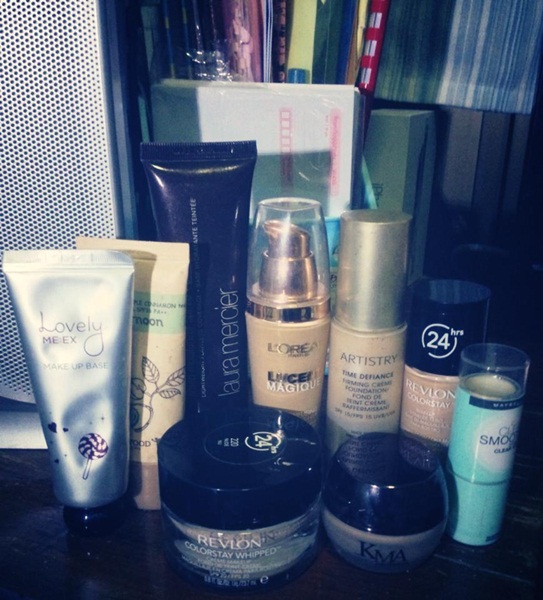
This screenshot has width=543, height=600. Identify the location of jar. (356, 549).